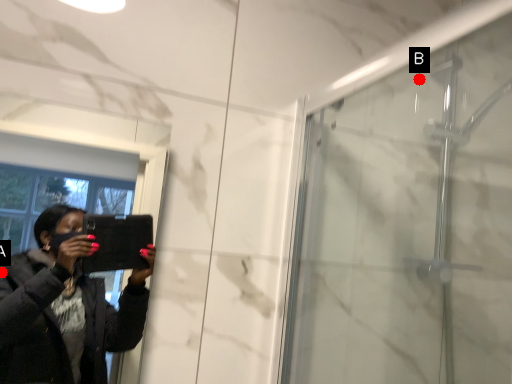
Question: Two points are circled on the image, labeled by A and B beside each circle. Which point is closer to the camera taking this photo?

Choices:
 (A) A is closer
 (B) B is closer

Answer: (B)